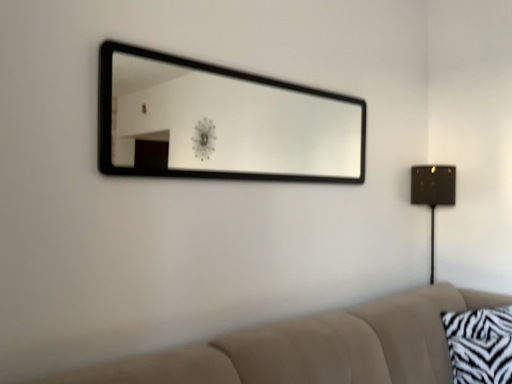
Question: Is beige fabric couch at lower right oriented away from zebra-patterned fabric pillow at lower right?

Choices:
 (A) no
 (B) yes

Answer: (A)

Question: Does beige fabric couch at lower right have a larger size compared to zebra-patterned fabric pillow at lower right?

Choices:
 (A) yes
 (B) no

Answer: (A)

Question: From a real-world perspective, is beige fabric couch at lower right positioned under zebra-patterned fabric pillow at lower right based on gravity?

Choices:
 (A) yes
 (B) no

Answer: (B)

Question: Would you say beige fabric couch at lower right is outside zebra-patterned fabric pillow at lower right?

Choices:
 (A) no
 (B) yes

Answer: (B)

Question: From a real-world perspective, is beige fabric couch at lower right over zebra-patterned fabric pillow at lower right?

Choices:
 (A) yes
 (B) no

Answer: (A)

Question: Considering the positions of zebra-patterned fabric pillow at lower right and beige fabric couch at lower right in the image, is zebra-patterned fabric pillow at lower right wider or thinner than beige fabric couch at lower right?

Choices:
 (A) thin
 (B) wide

Answer: (A)

Question: Is zebra-patterned fabric pillow at lower right bigger or smaller than beige fabric couch at lower right?

Choices:
 (A) big
 (B) small

Answer: (B)

Question: In the image, is zebra-patterned fabric pillow at lower right positioned in front of or behind beige fabric couch at lower right?

Choices:
 (A) front
 (B) behind

Answer: (B)

Question: Visually, is zebra-patterned fabric pillow at lower right positioned to the left or to the right of beige fabric couch at lower right?

Choices:
 (A) left
 (B) right

Answer: (B)

Question: Is beige fabric couch at lower right taller or shorter than black frame mirror at upper center?

Choices:
 (A) short
 (B) tall

Answer: (A)

Question: Is beige fabric couch at lower right bigger or smaller than black frame mirror at upper center?

Choices:
 (A) small
 (B) big

Answer: (B)

Question: Which is correct: beige fabric couch at lower right is inside black frame mirror at upper center, or outside of it?

Choices:
 (A) inside
 (B) outside

Answer: (B)

Question: From the image's perspective, relative to black frame mirror at upper center, is beige fabric couch at lower right above or below?

Choices:
 (A) above
 (B) below

Answer: (B)

Question: Does point (441, 195) appear closer or farther from the camera than point (462, 357)?

Choices:
 (A) farther
 (B) closer

Answer: (A)

Question: From a real-world perspective, relative to zebra-patterned fabric pillow at lower right, is metallic gold table lamp at right vertically above or below?

Choices:
 (A) below
 (B) above

Answer: (B)